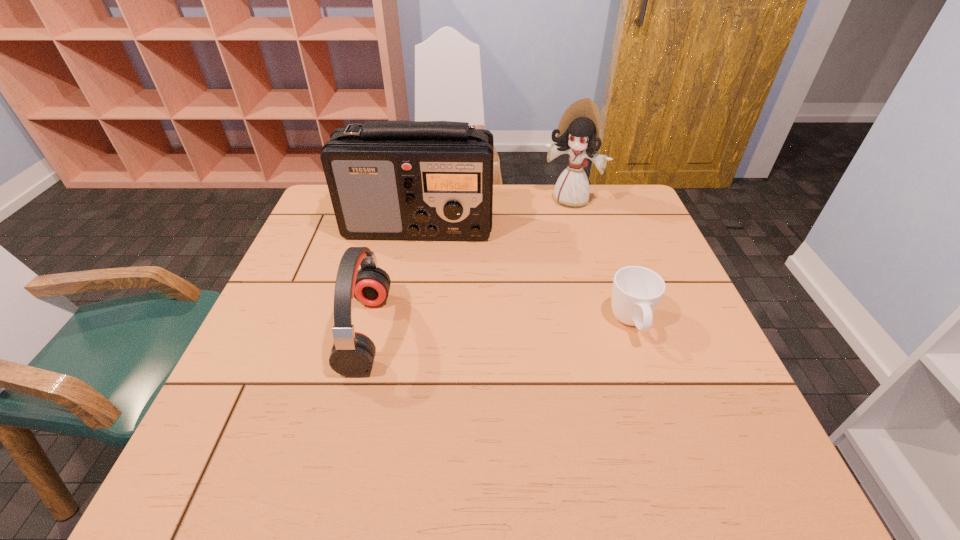
What are the coordinates of `earphone` in the screenshot? It's located at (352, 355).

Where is `the shortest object`? the shortest object is located at coordinates (636, 292).

Locate an element on the screen. The height and width of the screenshot is (540, 960). radio receiver is located at coordinates (413, 180).

You are a GUI agent. You are given a task and a screenshot of the screen. Output one action in this format:
    pyautogui.click(x=<x>, y=<y>)
    Task: Click on the doll
    The width and height of the screenshot is (960, 540).
    Given the screenshot: What is the action you would take?
    pyautogui.click(x=578, y=131)

At what (x,y) coordinates should I click in order to perform the action: click on blank space located 0.140m on the ear cups of the third tallest object. Please return your answer as a coordinate pair (x, y). The height and width of the screenshot is (540, 960). Looking at the image, I should click on (446, 332).

Find the location of a particular element. Image resolution: width=960 pixels, height=540 pixels. free space located 0.190m with the handle on the side of the cup is located at coordinates (667, 429).

Find the location of a particular element. The width and height of the screenshot is (960, 540). vacant space located on the front panel of the radio receiver is located at coordinates (485, 286).

At what (x,y) coordinates should I click in order to perform the action: click on vacant space situated 0.260m on the front panel of the radio receiver. Please return your answer as a coordinate pair (x, y). This screenshot has width=960, height=540. Looking at the image, I should click on 496,301.

Find the location of a particular element. This screenshot has width=960, height=540. free location located on the front panel of the radio receiver is located at coordinates (500, 306).

Locate an element on the screen. Image resolution: width=960 pixels, height=540 pixels. blank space located at the front face of the doll is located at coordinates (516, 274).